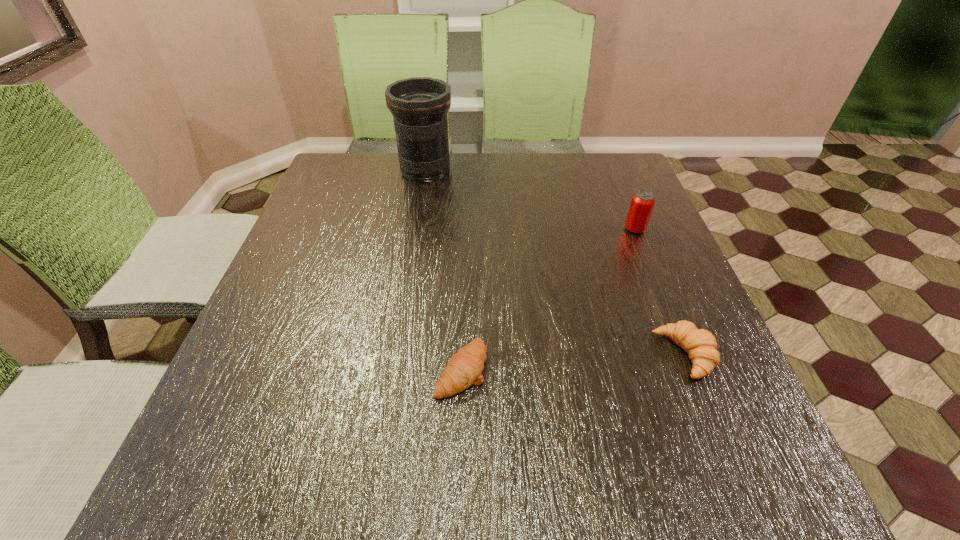
Locate an element on the screen. the tallest object is located at coordinates (419, 105).

This screenshot has height=540, width=960. I want to click on telephoto lens, so click(x=419, y=105).

What are the coordinates of `can` in the screenshot? It's located at (642, 203).

I want to click on the third nearest object, so click(x=642, y=203).

Image resolution: width=960 pixels, height=540 pixels. In order to click on the right crescent roll in this screenshot , I will do [700, 344].

The height and width of the screenshot is (540, 960). I want to click on the left crescent roll, so click(x=464, y=368).

Image resolution: width=960 pixels, height=540 pixels. I want to click on free space located on the front of the tallest object, so click(413, 247).

At what (x,y) coordinates should I click in order to perform the action: click on vacant area located on the back of the second farthest object. Please return your answer as a coordinate pair (x, y). The width and height of the screenshot is (960, 540). Looking at the image, I should click on (612, 173).

The height and width of the screenshot is (540, 960). Find the location of `blank space located on the left of the right crescent roll`. blank space located on the left of the right crescent roll is located at coordinates click(521, 355).

The image size is (960, 540). Identify the location of vacant area situated 0.100m on the front of the left crescent roll. (458, 459).